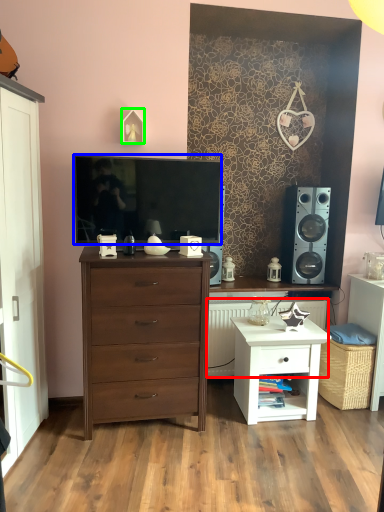
Question: Which object is the farthest from radiator (highlighted by a red box)? Choose among these: television (highlighted by a blue box) or picture frame (highlighted by a green box).

Choices:
 (A) television
 (B) picture frame

Answer: (B)